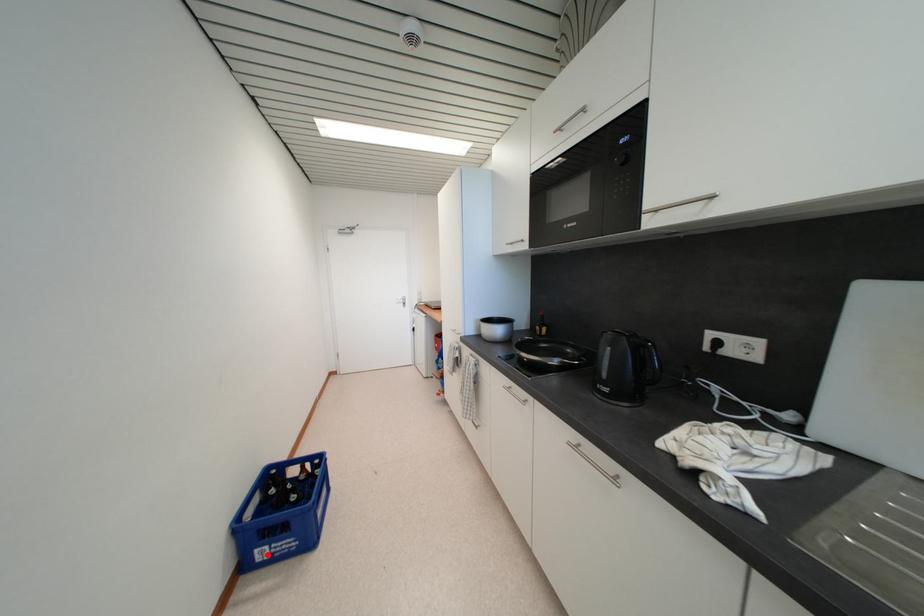
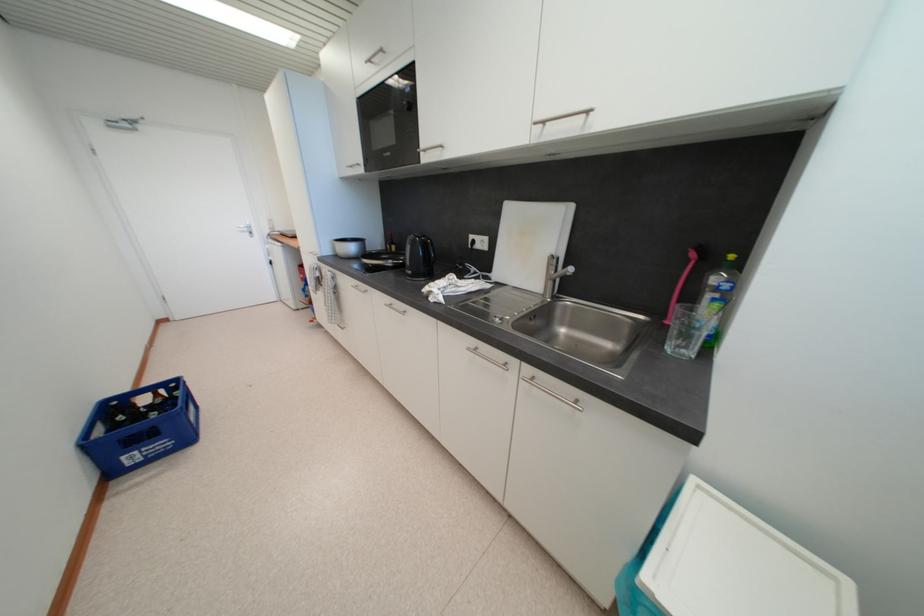
Question: A red point is marked in image1. In image2, is the corresponding 3D point closer to the camera or farther? Reply with the corresponding letter.

Choices:
 (A) The corresponding 3D point is closer.
 (B) The corresponding 3D point is farther.

Answer: (A)